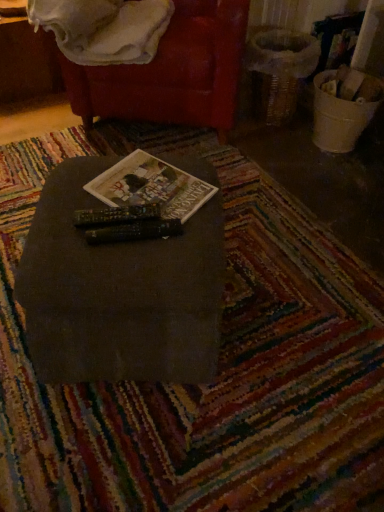
Identify the location of free space in front of matte black table at center. (144, 444).